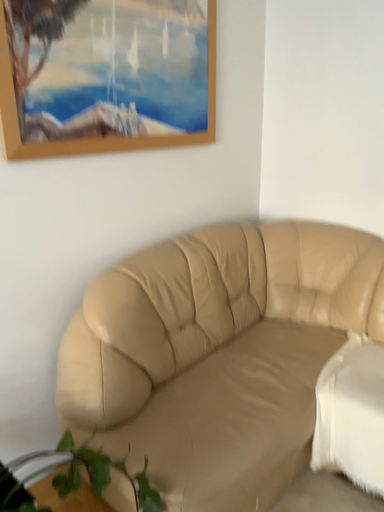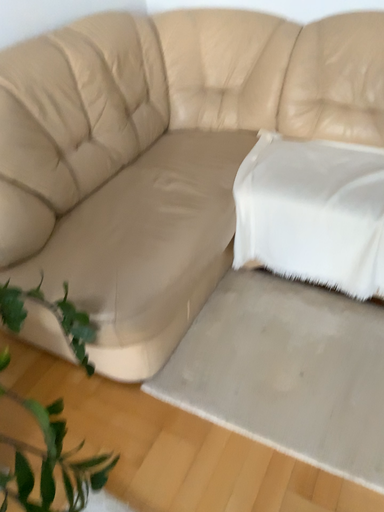
Question: Which way did the camera rotate in the video?

Choices:
 (A) rotated upward
 (B) rotated downward

Answer: (B)